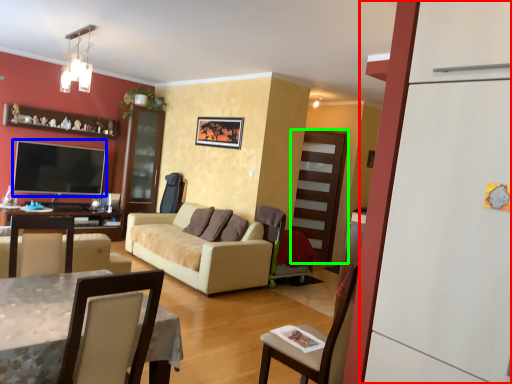
Question: Which is farther away from fridge (highlighted by a red box)? television (highlighted by a blue box) or glass door (highlighted by a green box)?

Choices:
 (A) television
 (B) glass door

Answer: (A)